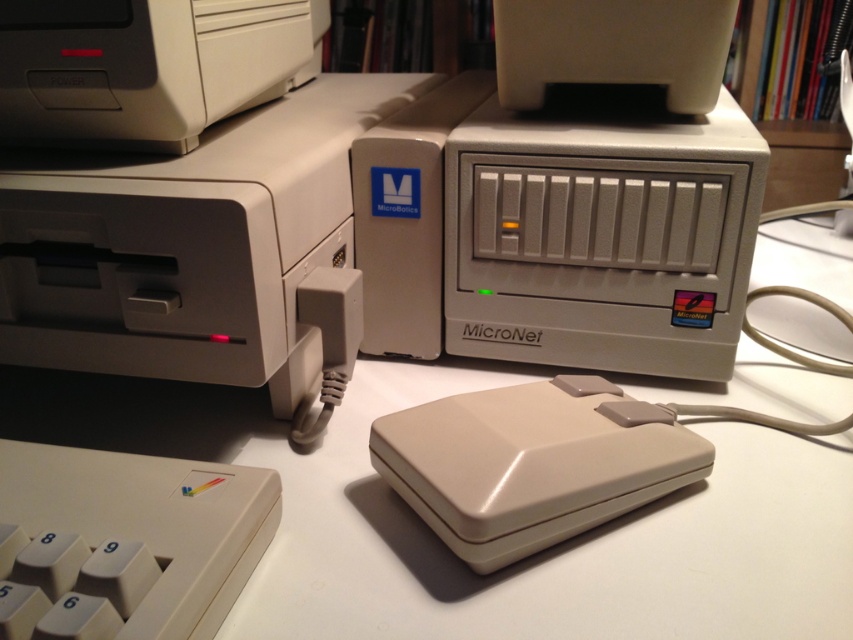
Question: Which object appears closest to the camera in this image?

Choices:
 (A) matte plastic micronet at center
 (B) matte plastic printer at upper left

Answer: (B)

Question: Which point is closer to the camera?

Choices:
 (A) white plastic table at center
 (B) beige plastic mouse at center

Answer: (A)

Question: Is matte plastic printer at upper left to the right of matte white printer at upper left from the viewer's perspective?

Choices:
 (A) no
 (B) yes

Answer: (B)

Question: Is beige matte keyboard at lower left wider than beige plastic mouse at center?

Choices:
 (A) yes
 (B) no

Answer: (B)

Question: Can you confirm if beige plastic mouse at center is positioned above matte white printer at upper left?

Choices:
 (A) yes
 (B) no

Answer: (B)

Question: Which of the following is the closest to the observer?

Choices:
 (A) white plastic table at center
 (B) beige matte keyboard at lower left
 (C) matte white printer at upper left

Answer: (B)